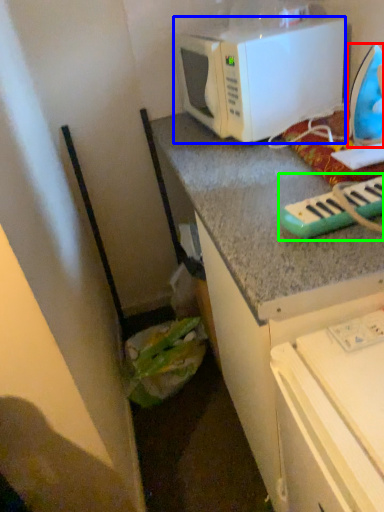
Question: Which object is the closest to the appliance (highlighted by a red box)? Choose among these: microwave oven (highlighted by a blue box) or musical keyboard (highlighted by a green box).

Choices:
 (A) microwave oven
 (B) musical keyboard

Answer: (A)